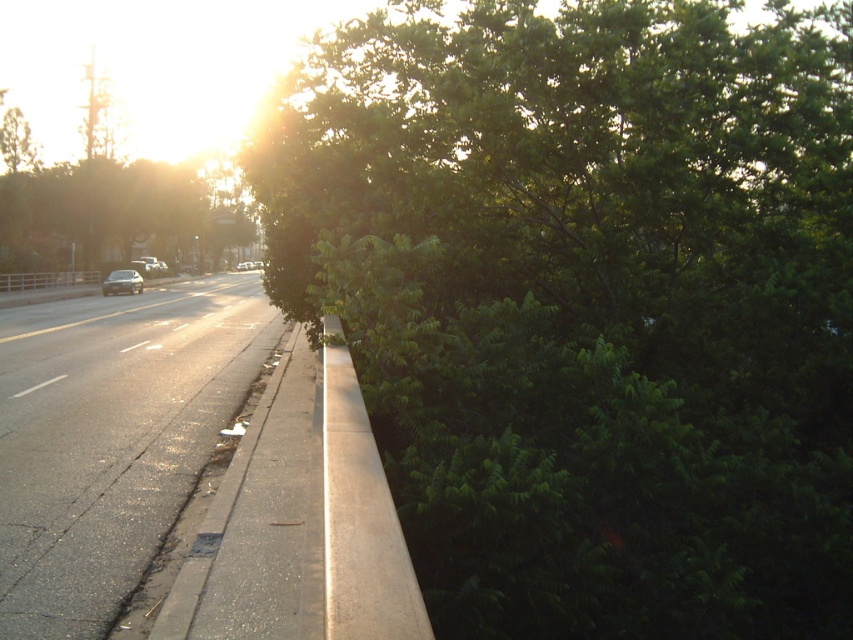
Between point (373, 273) and point (344, 576), which one is positioned in front?

Point (344, 576) is in front.

From the picture: Who is taller, green leafy tree at upper right or concrete at center?

green leafy tree at upper right

Between point (634, 595) and point (368, 506), which one is positioned in front?

Point (368, 506)

I want to click on green leafy tree at upper right, so click(x=587, y=304).

Which is more to the right, green leafy tree at upper right or asphalt road at lower left?

green leafy tree at upper right

Is green leafy tree at upper right closer to camera compared to asphalt road at lower left?

Yes, green leafy tree at upper right is closer to the viewer.

Describe the element at coordinates (587, 304) in the screenshot. The width and height of the screenshot is (853, 640). I see `green leafy tree at upper right` at that location.

The height and width of the screenshot is (640, 853). Find the location of `green leafy tree at upper right`. green leafy tree at upper right is located at coordinates (587, 304).

How far apart are concrete at center and satin silver sedan at left?

concrete at center is 48.70 meters away from satin silver sedan at left.

The image size is (853, 640). What do you see at coordinates (361, 522) in the screenshot?
I see `concrete at center` at bounding box center [361, 522].

The width and height of the screenshot is (853, 640). What are the coordinates of `concrete at center` in the screenshot? It's located at (361, 522).